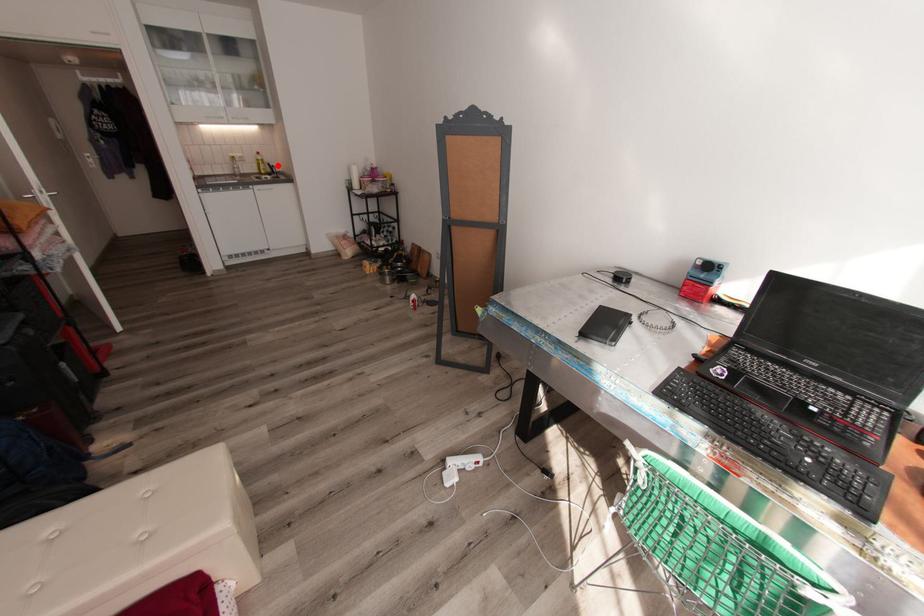
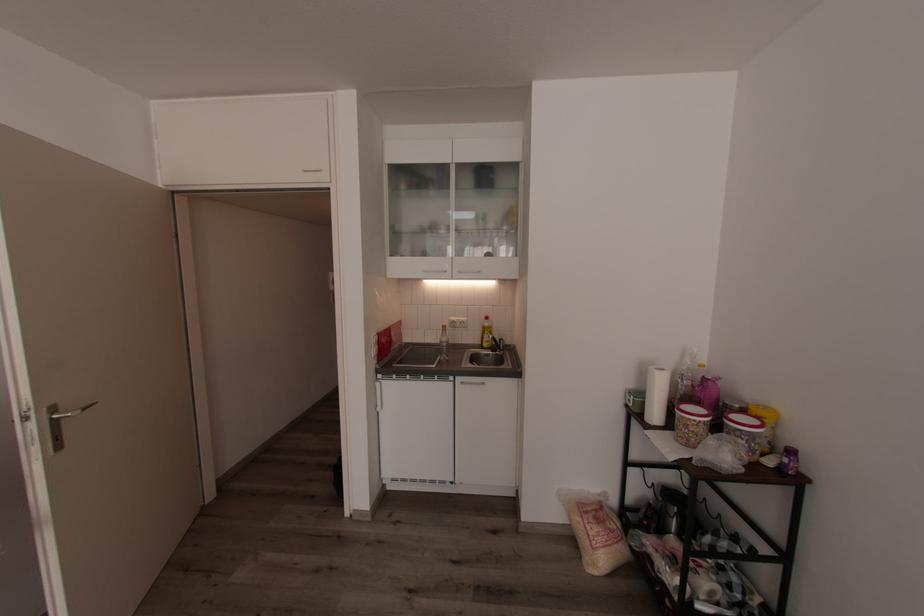
Where in the second image is the point corresponding to the highlighted location from the first image?

(505, 339)